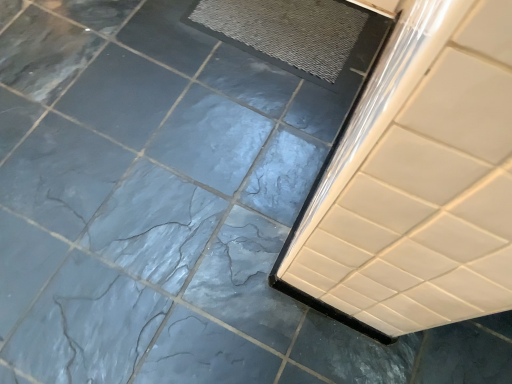
Describe the element at coordinates (286, 32) in the screenshot. This screenshot has height=384, width=512. I see `textured gray mat at upper center` at that location.

At what (x,y) coordinates should I click in order to perform the action: click on textured gray mat at upper center. Please return your answer as a coordinate pair (x, y). Looking at the image, I should click on (286, 32).

Image resolution: width=512 pixels, height=384 pixels. Identify the location of textured gray mat at upper center. (286, 32).